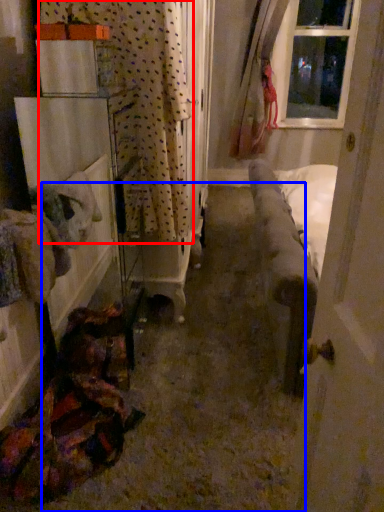
Question: Which of the following is the farthest to the observer, curtain (highlighted by a red box) or path (highlighted by a blue box)?

Choices:
 (A) curtain
 (B) path

Answer: (A)